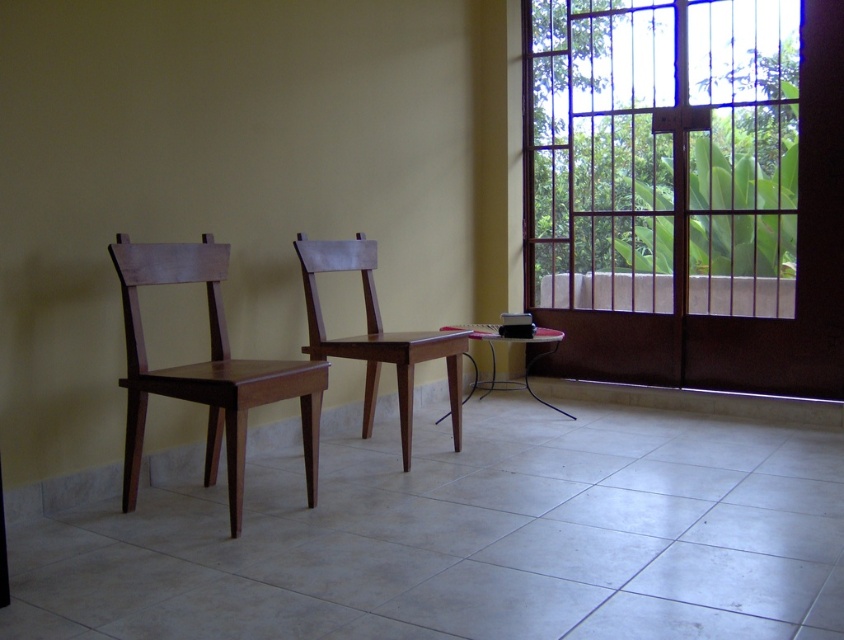
Question: Which of the following is the closest to the observer?

Choices:
 (A) metallic silver table at center
 (B) matte wood chair at left
 (C) clear glass window at upper right
 (D) matte wood chair at center

Answer: (B)

Question: Which object appears closest to the camera in this image?

Choices:
 (A) matte wood chair at left
 (B) clear glass window at upper right

Answer: (A)

Question: Is clear glass window at upper right to the right of metallic silver table at center from the viewer's perspective?

Choices:
 (A) no
 (B) yes

Answer: (B)

Question: Is matte wood chair at left further to the viewer compared to matte wood chair at center?

Choices:
 (A) no
 (B) yes

Answer: (A)

Question: Which point appears closest to the camera in this image?

Choices:
 (A) (436, 342)
 (B) (142, 413)

Answer: (B)

Question: Can you confirm if clear glass window at upper right is thinner than metallic silver table at center?

Choices:
 (A) yes
 (B) no

Answer: (B)